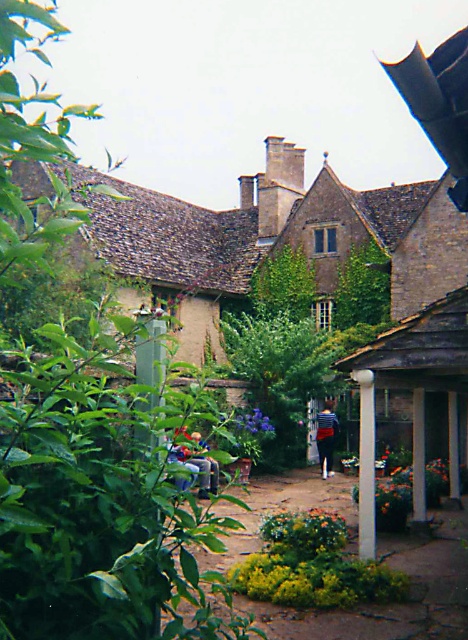
Does white painted wood at center come behind purple matte flower at center?

No, it is in front of purple matte flower at center.

Which is below, white painted wood at center or purple matte flower at center?

white painted wood at center is below.

Identify the location of white painted wood at center. This screenshot has width=468, height=640. (417, 456).

Is striped shirt at center wider than purple matte flower at center?

Incorrect, striped shirt at center's width does not surpass purple matte flower at center's.

Which is more to the right, striped shirt at center or purple matte flower at center?

striped shirt at center

Which is in front, point (327, 435) or point (251, 419)?

Point (251, 419) is more forward.

The height and width of the screenshot is (640, 468). I want to click on striped shirt at center, so click(x=326, y=436).

Is white smooth pillar at center closer to the viewer compared to white painted wood at center?

Yes, it is.

Based on the photo, between white smooth pillar at center and white painted wood at center, which one is positioned higher?

Positioned higher is white smooth pillar at center.

Is point (359, 531) in front of point (424, 452)?

Yes, it is in front of point (424, 452).

At what (x,y) coordinates should I click in order to perform the action: click on white smooth pillar at center. Please return your answer as a coordinate pair (x, y). This screenshot has width=468, height=640. Looking at the image, I should click on (365, 465).